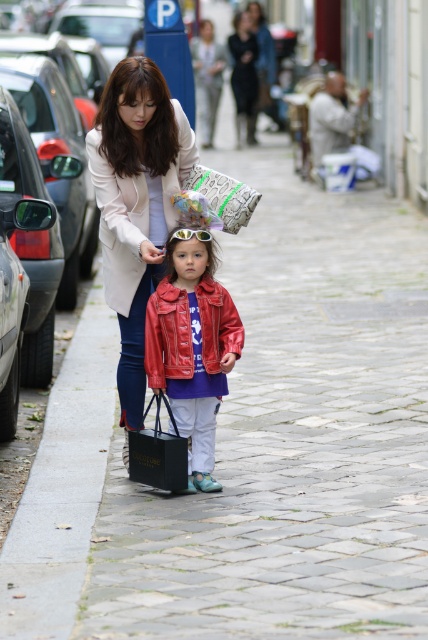
You are a delivery person needing to place a package between the matte black car at left and the black matte bag at center. The package requires 20 feet of space. Can you fit it there?

The distance between the matte black car at left and the black matte bag at center is 19.70 feet, which is slightly less than the required 20 feet. Therefore, the package cannot be placed there.

You are a pedestrian standing on the sidewalk and see the matte black car at left and the black matte bag at center. Which object is closer to you?

The matte black car at left is closer to you since it is positioned further to the viewer than the black matte bag at center.